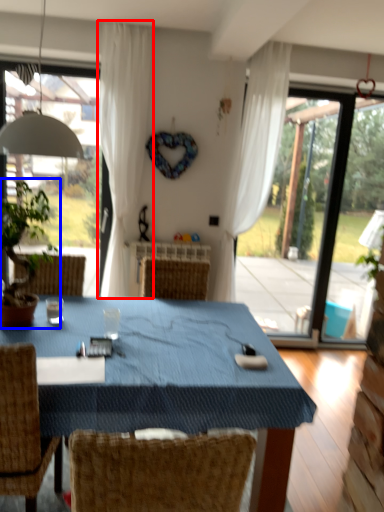
Question: Which point is further to the camera, curtain (highlighted by a red box) or houseplant (highlighted by a blue box)?

Choices:
 (A) curtain
 (B) houseplant

Answer: (A)